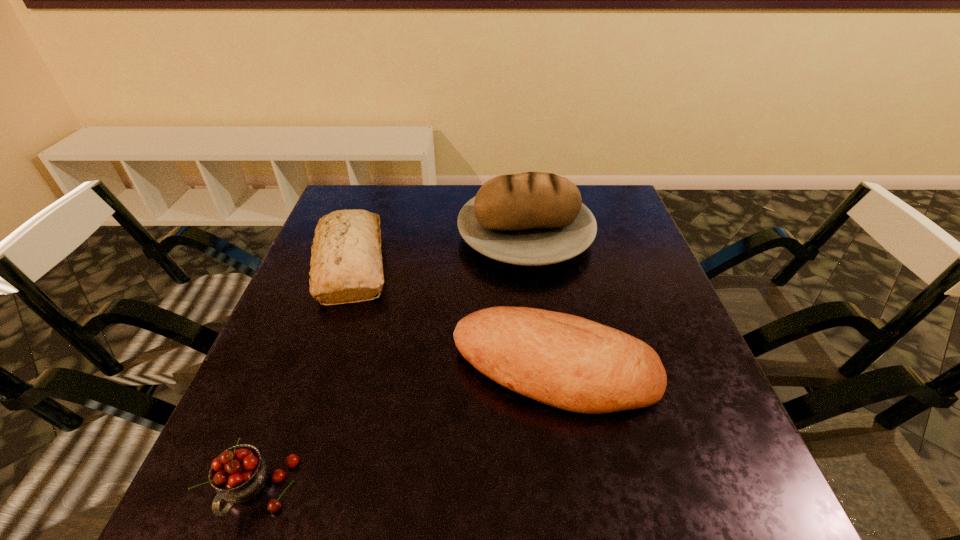
In order to click on vacant space that is in between the tallest object and the leftmost bread in this screenshot , I will do `click(439, 250)`.

This screenshot has width=960, height=540. What are the coordinates of `free spot between the leftmost bread and the tallest object` in the screenshot? It's located at (439, 250).

This screenshot has width=960, height=540. Find the location of `vacant point located between the leftmost bread and the nearest object`. vacant point located between the leftmost bread and the nearest object is located at coordinates (304, 377).

Locate an element on the screen. free space between the nearest bread and the cherry is located at coordinates (405, 430).

Find the location of a particular element. free point between the cherry and the tallest bread is located at coordinates (391, 363).

This screenshot has height=540, width=960. I want to click on vacant space that's between the cherry and the leftmost bread, so click(304, 377).

Where is `vacant point located between the third farthest object and the nearest object`? This screenshot has height=540, width=960. vacant point located between the third farthest object and the nearest object is located at coordinates (405, 430).

Locate which object is the third closest to the cherry. Please provide its 2D coordinates. Your answer should be formatted as a tuple, i.e. [(x, y)], where the tuple contains the x and y coordinates of a point satisfying the conditions above.

[(533, 218)]

Find the location of a particular element. This screenshot has width=960, height=540. object that is the third closest one to the tallest object is located at coordinates (238, 474).

Select which bread is the closest to the tallest bread. Please provide its 2D coordinates. Your answer should be formatted as a tuple, i.e. [(x, y)], where the tuple contains the x and y coordinates of a point satisfying the conditions above.

[(566, 361)]